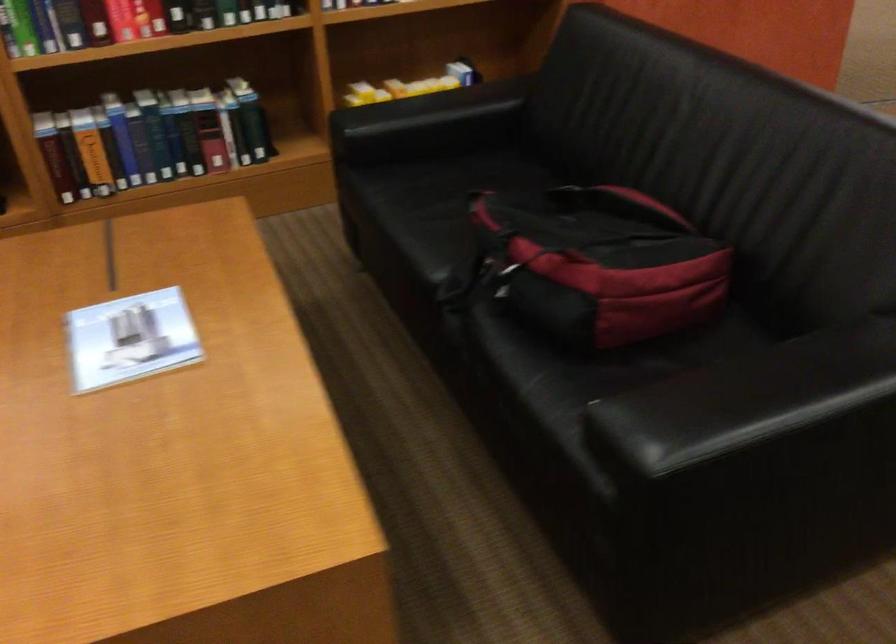
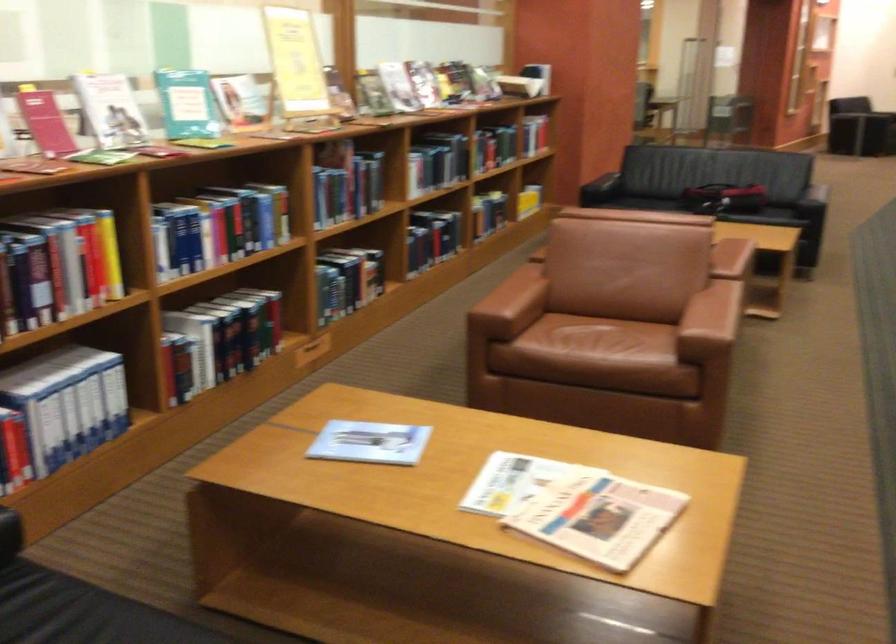
The point at (151, 138) is marked in the first image. Where is the corresponding point in the second image?

(504, 207)